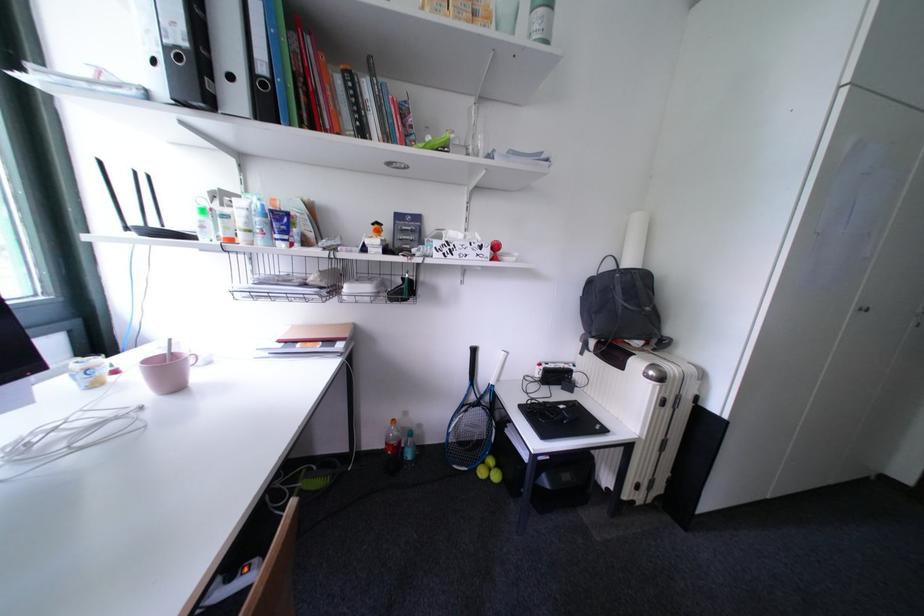
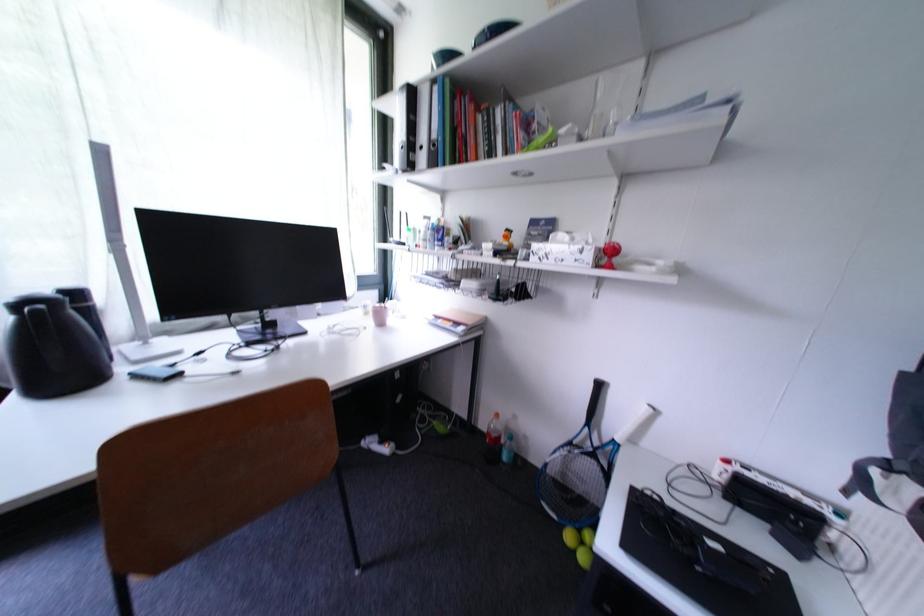
Find the pixel in the second image that matches pixel 479 151 in the first image.

(594, 136)